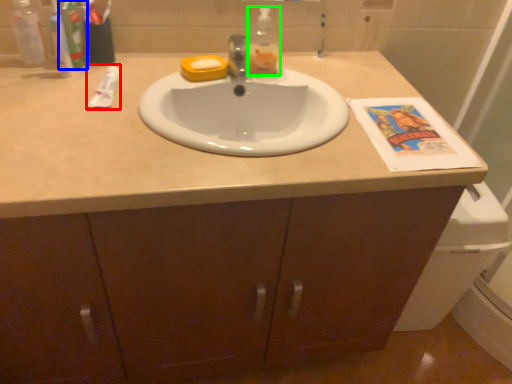
Question: Estimate the real-world distances between objects in this image. Which object is farther from toothpaste (highlighted by a red box), toiletry (highlighted by a blue box) or bottle (highlighted by a green box)?

Choices:
 (A) toiletry
 (B) bottle

Answer: (B)